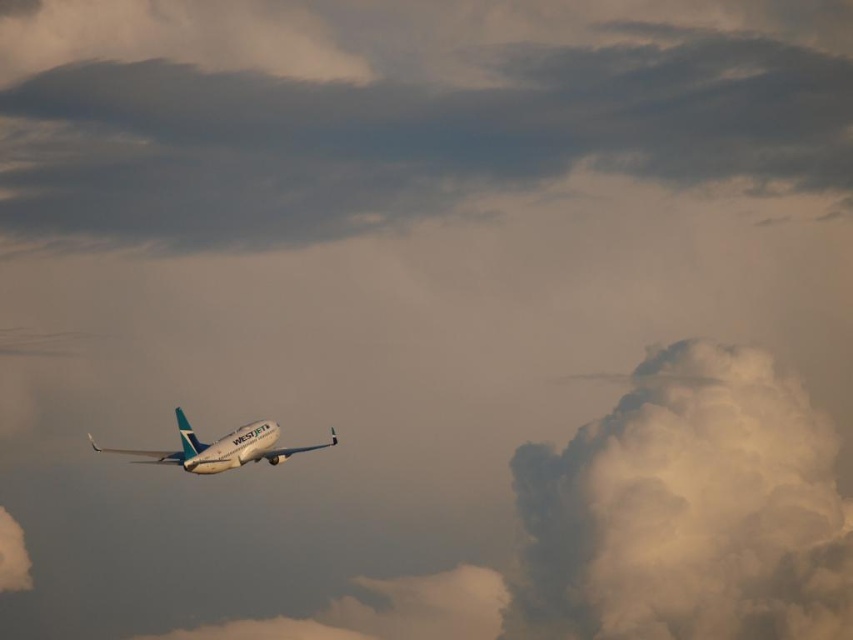
I want to click on gray fluffy cloud at upper center, so click(x=396, y=109).

Which is below, gray fluffy cloud at upper center or white fluffy cloud at upper right?

white fluffy cloud at upper right

Is point (506, 90) farther from viewer compared to point (683, 580)?

Yes, it is behind point (683, 580).

Identify the location of gray fluffy cloud at upper center. This screenshot has height=640, width=853. (396, 109).

How much distance is there between gray fluffy cloud at upper center and white glossy airplane at center?

gray fluffy cloud at upper center is 79.36 meters from white glossy airplane at center.

Which of these two, gray fluffy cloud at upper center or white glossy airplane at center, stands shorter?

With less height is white glossy airplane at center.

Is point (425, 12) positioned before point (187, 424)?

No, it is behind (187, 424).

Where is `gray fluffy cloud at upper center`? gray fluffy cloud at upper center is located at coordinates (396, 109).

Between white fluffy cloud at upper right and white glossy airplane at center, which one has less height?

With less height is white glossy airplane at center.

Can you confirm if white fluffy cloud at upper right is smaller than white glossy airplane at center?

No, white fluffy cloud at upper right is not smaller than white glossy airplane at center.

Where is `white fluffy cloud at upper right`? white fluffy cloud at upper right is located at coordinates (686, 512).